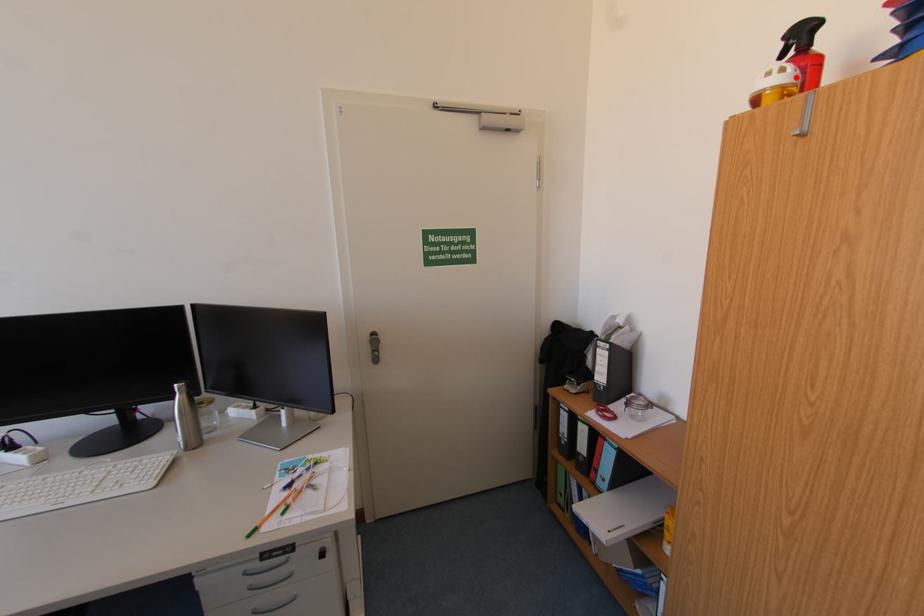
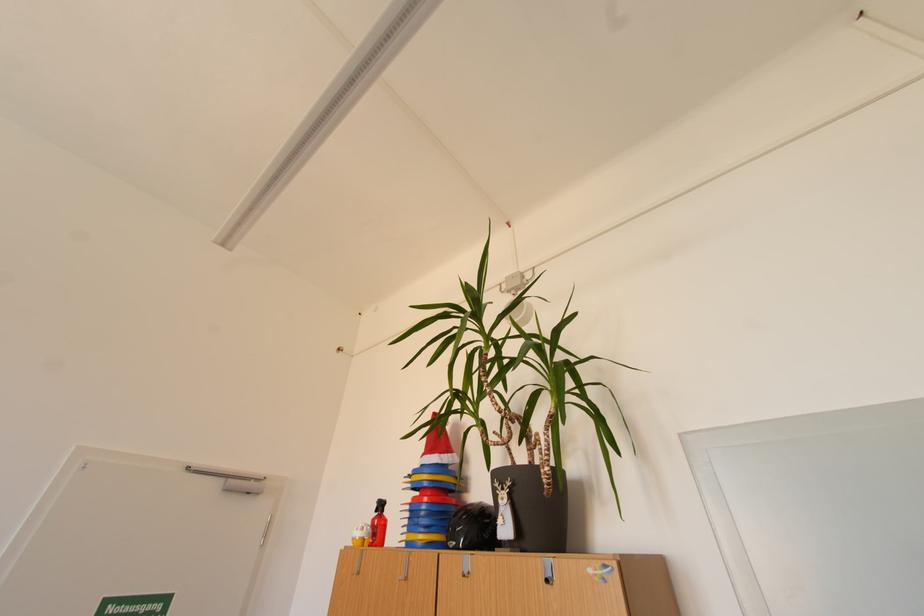
Locate, in the second image, the point that corresponds to the highlighted location in the first image.

(373, 533)